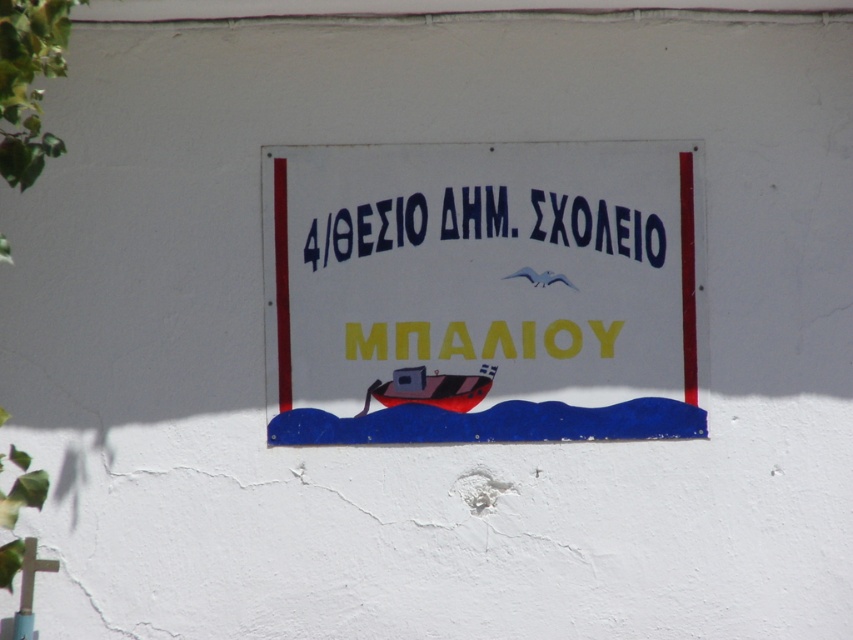
You are an architect designing a new wall display. The wall has limited vertical space. You need to place the white plastic signboard at center and the black painted text at center. Which object should you prioritize placing first to fit within the vertical constraints?

The white plastic signboard at center is much taller than the black painted text at center, so you should prioritize placing the white plastic signboard at center first to ensure it fits within the vertical constraints.

You are standing in front of the signboard and want to know if the point at coordinate (628, 241) is closer to you than the point at coordinate (380, 396). Can you determine this based on the signboard design?

Point (628, 241) is behind point (380, 396), so it is farther away from you.

You are an interior designer planning to hang a new decorative item on the wall where the white plastic signboard at center and the black painted text at center are located. You want to ensure that the new item does not cover any existing elements. Which object should you avoid placing a larger item over?

You should avoid placing a larger item over the white plastic signboard at center because it is larger in size than the black painted text at center, so covering it might obscure the smaller text.